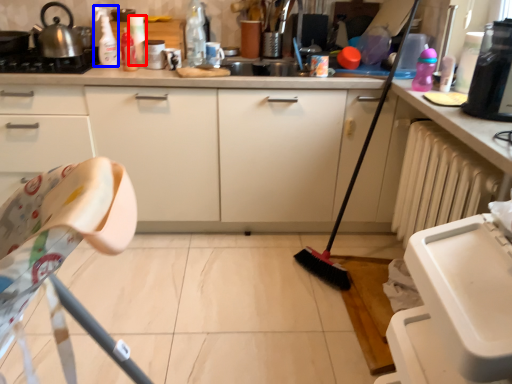
Question: Among these objects, which one is farthest to the camera, bottle (highlighted by a red box) or cleaning product (highlighted by a blue box)?

Choices:
 (A) bottle
 (B) cleaning product

Answer: (A)